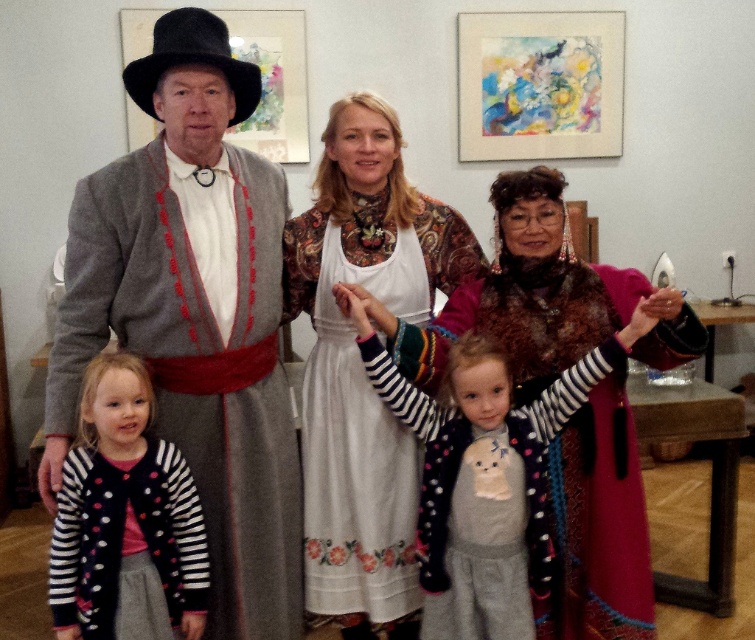
Question: Which object is positioned farthest from the black felt hat at upper left?

Choices:
 (A) white cotton dress at center
 (B) striped knit cardigan at lower left
 (C) velvet maroon coat at center

Answer: (C)

Question: Is white cotton dress at center to the left of black felt hat at upper left from the viewer's perspective?

Choices:
 (A) yes
 (B) no

Answer: (B)

Question: Which of the following is the closest to the observer?

Choices:
 (A) (257, 406)
 (B) (226, 81)
 (C) (550, 353)
 (D) (510, 636)

Answer: (B)

Question: Can you confirm if white cotton dress at center is bigger than striped knit sweater at center?

Choices:
 (A) no
 (B) yes

Answer: (B)

Question: Is white cotton dress at center bigger than striped knit sweater at center?

Choices:
 (A) no
 (B) yes

Answer: (B)

Question: Which object is positioned closest to the striped knit cardigan at lower left?

Choices:
 (A) black felt hat at upper left
 (B) striped knit sweater at center
 (C) velvet maroon coat at center
 (D) white cotton dress at center

Answer: (D)